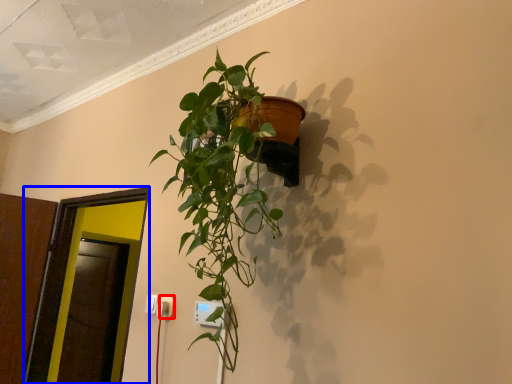
Question: Which of the following is the farthest to the observer, electric outlet (highlighted by a red box) or glass door (highlighted by a blue box)?

Choices:
 (A) electric outlet
 (B) glass door

Answer: (B)